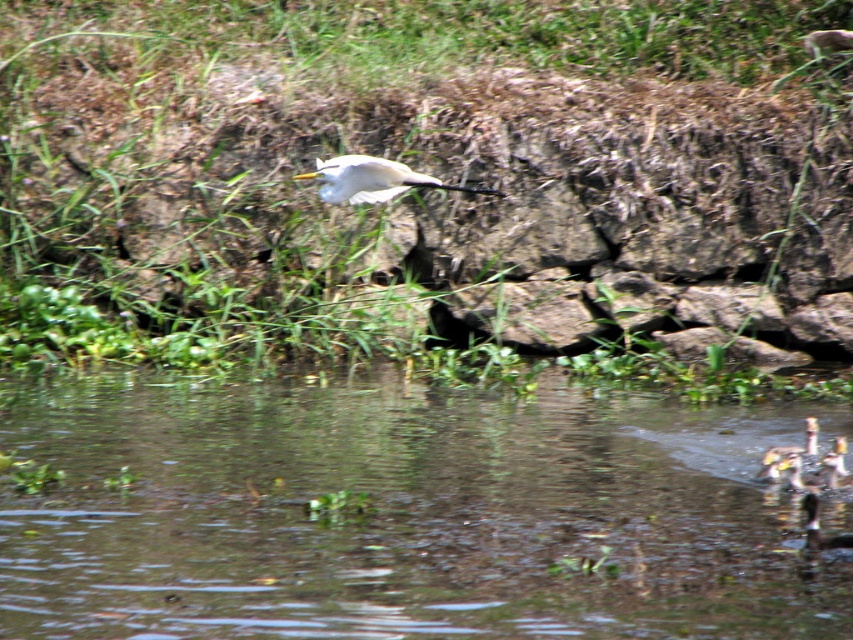
Who is positioned more to the right, clear water at lower center or white glossy bird at center?

From the viewer's perspective, clear water at lower center appears more on the right side.

Describe the element at coordinates (402, 513) in the screenshot. This screenshot has width=853, height=640. I see `clear water at lower center` at that location.

This screenshot has height=640, width=853. Find the location of `clear water at lower center`. clear water at lower center is located at coordinates (402, 513).

I want to click on clear water at lower center, so click(402, 513).

Between point (250, 385) and point (775, 452), which one is positioned behind?

The point (250, 385) is behind.

Is point (409, 563) closer to viewer compared to point (804, 454)?

Yes.

This screenshot has height=640, width=853. In order to click on clear water at lower center in this screenshot , I will do `click(402, 513)`.

Between point (444, 182) and point (811, 436), which one is positioned behind?

The point (444, 182) is behind.

Is white glossy bird at center positioned behind white feathered bird at lower right?

That is True.

Who is more forward, (306, 172) or (776, 451)?

Point (776, 451) is in front.

Image resolution: width=853 pixels, height=640 pixels. Find the location of `white glossy bird at center`. white glossy bird at center is located at coordinates (372, 179).